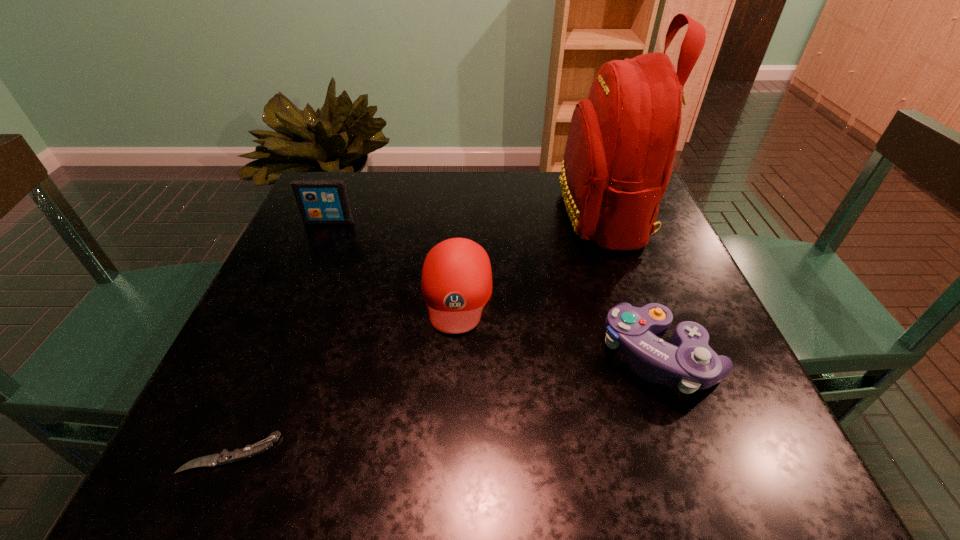
Find the location of a particular element. Image resolution: width=960 pixels, height=540 pixels. backpack is located at coordinates (622, 140).

You are a GUI agent. You are given a task and a screenshot of the screen. Output one action in this format:
    pyautogui.click(x=<x>, y=<y>)
    Task: Click on the iPod
    This screenshot has height=540, width=960.
    Given the screenshot: What is the action you would take?
    pyautogui.click(x=320, y=201)

Where is `the third object from left to right`? This screenshot has width=960, height=540. the third object from left to right is located at coordinates (456, 283).

Locate an element on the screen. This screenshot has width=960, height=540. control is located at coordinates (689, 361).

Find the location of `the nearest object`. the nearest object is located at coordinates (225, 457).

Where is `pocketknife`? pocketknife is located at coordinates (225, 457).

The height and width of the screenshot is (540, 960). What are the coordinates of `vacant space located on the front-facing side of the tallest object` in the screenshot? It's located at [513, 214].

Identify the location of free region located on the front-facing side of the tallest object. Image resolution: width=960 pixels, height=540 pixels. (449, 214).

Locate an element on the screen. free space located 0.280m on the front-facing side of the tallest object is located at coordinates (449, 214).

I want to click on free space located 0.400m on the front screen of the iPod, so 271,357.